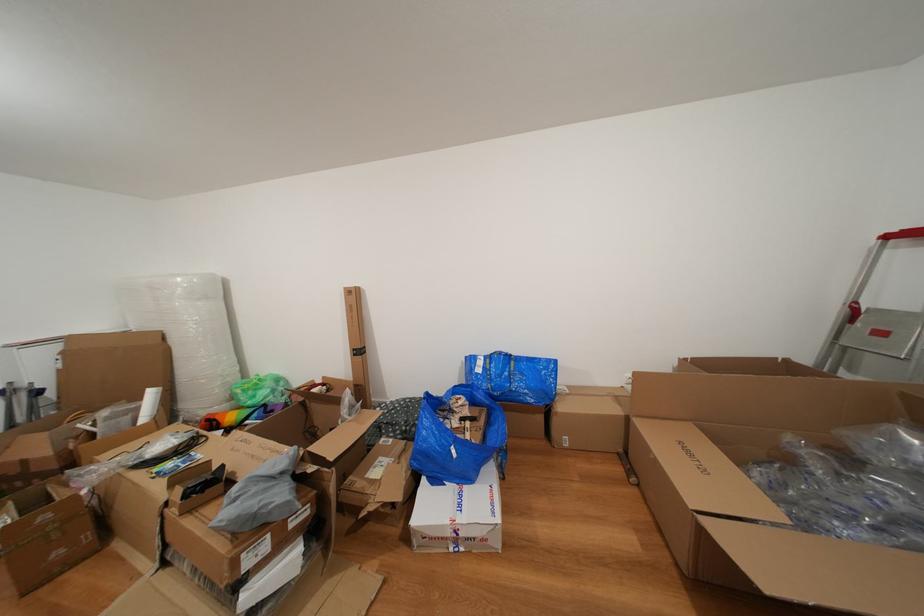
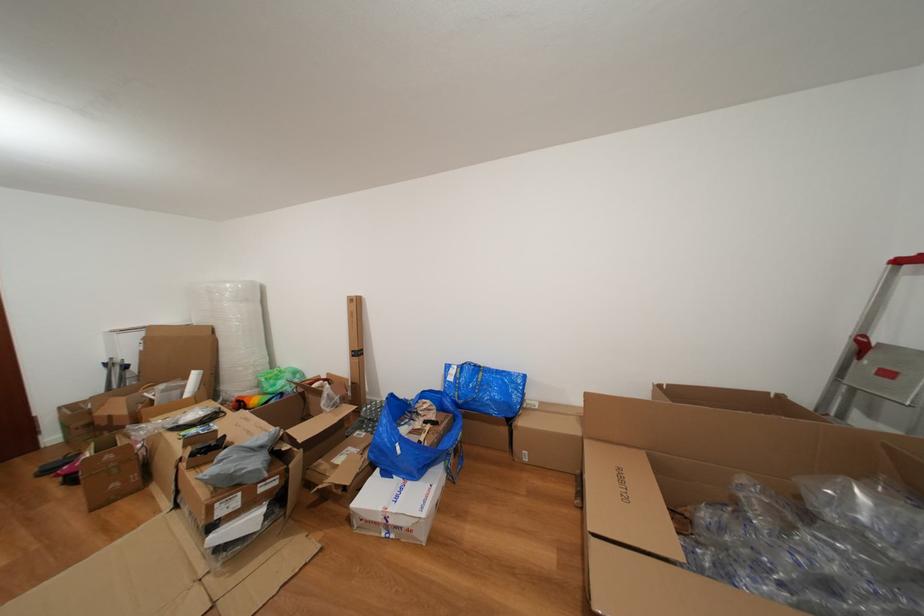
In the second image, find the point that corresponds to the point at 453,408 in the first image.

(418, 410)